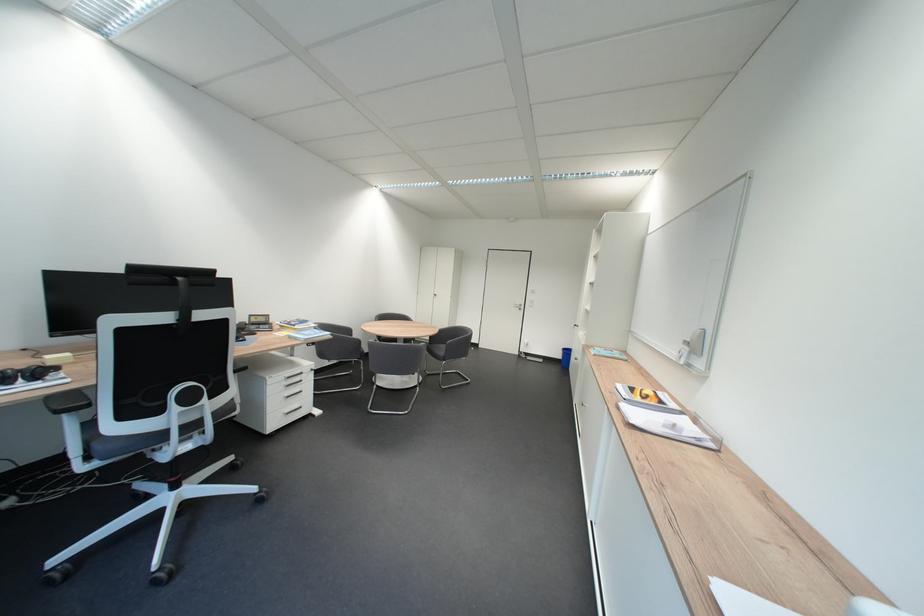
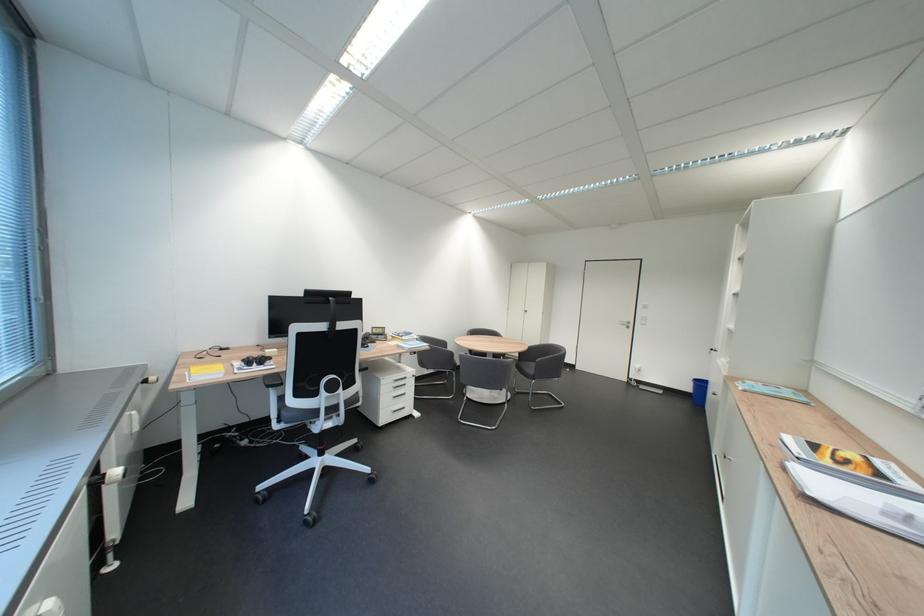
Question: Based on the continuous images, in which direction is the camera rotating? Reply with the corresponding letter.

Choices:
 (A) Left
 (B) Right
 (C) Up
 (D) Down

Answer: (A)